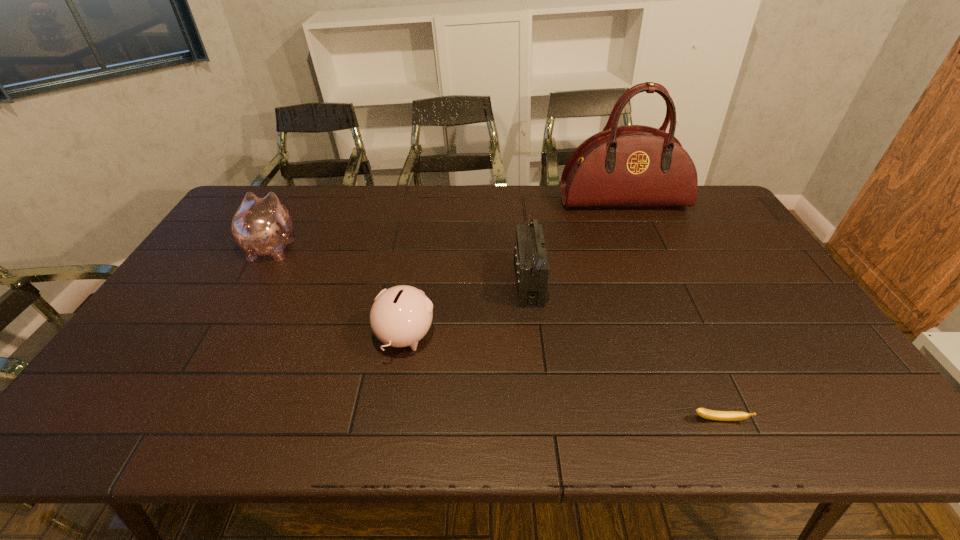
What are the coordinates of `free spot between the nearer piggy bank and the nearest object` in the screenshot? It's located at (562, 379).

Where is `free space that is in between the radio receiver and the nearer piggy bank`? free space that is in between the radio receiver and the nearer piggy bank is located at coordinates (467, 310).

Image resolution: width=960 pixels, height=540 pixels. What are the coordinates of `unoccupied area between the nearer piggy bank and the second tallest object` in the screenshot? It's located at (467, 310).

You are a GUI agent. You are given a task and a screenshot of the screen. Output one action in this format:
    pyautogui.click(x=<x>, y=<y>)
    Task: Click on the unoccupied area between the handbag and the nearer piggy bank
    The image size is (960, 540).
    Given the screenshot: What is the action you would take?
    pyautogui.click(x=514, y=269)

Find the location of a particular element. The image size is (960, 540). free space between the leftmost object and the shortest object is located at coordinates (495, 334).

Where is `vacant area between the nearest object and the tallest object`? The width and height of the screenshot is (960, 540). vacant area between the nearest object and the tallest object is located at coordinates (671, 310).

Find the location of a particular element. The image size is (960, 540). free spot between the shortest object and the fourth shortest object is located at coordinates (623, 352).

The image size is (960, 540). Find the location of `object that is the second closest one to the third object from left to right`. object that is the second closest one to the third object from left to right is located at coordinates (634, 165).

Find the location of a particular element. The width and height of the screenshot is (960, 540). the fourth closest object to the radio receiver is located at coordinates (261, 226).

Identify the location of free space that satisfies the following two spatial constraints: 1. on the front-facing side of the handbag; 2. on the front panel of the second tallest object. (659, 284).